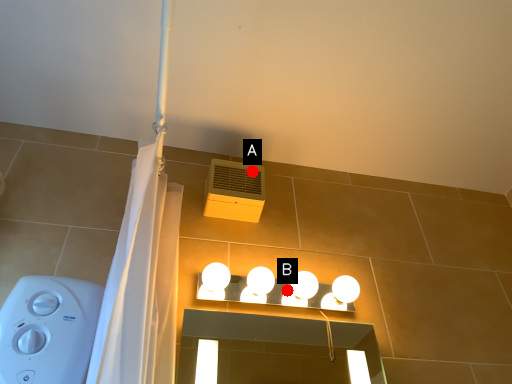
Question: Two points are circled on the image, labeled by A and B beside each circle. Which of the following is the closest to the observer?

Choices:
 (A) A is closer
 (B) B is closer

Answer: (B)